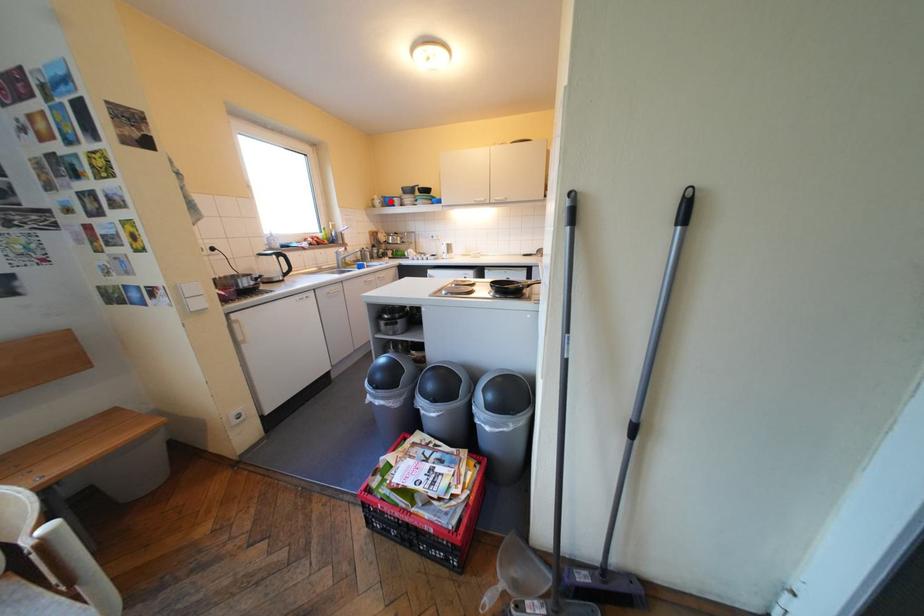
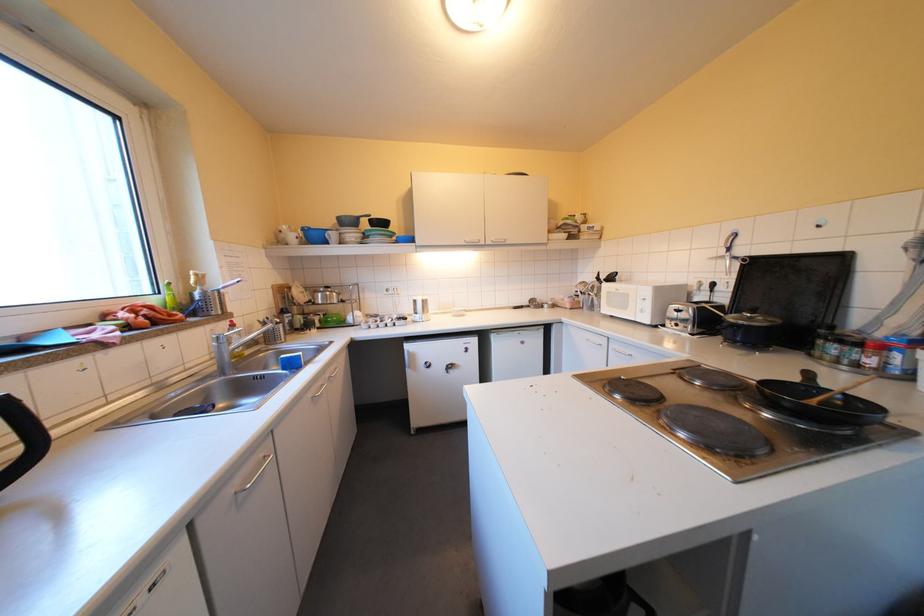
In the second image, find the point that corresponds to the highlighted location in the first image.

(305, 236)